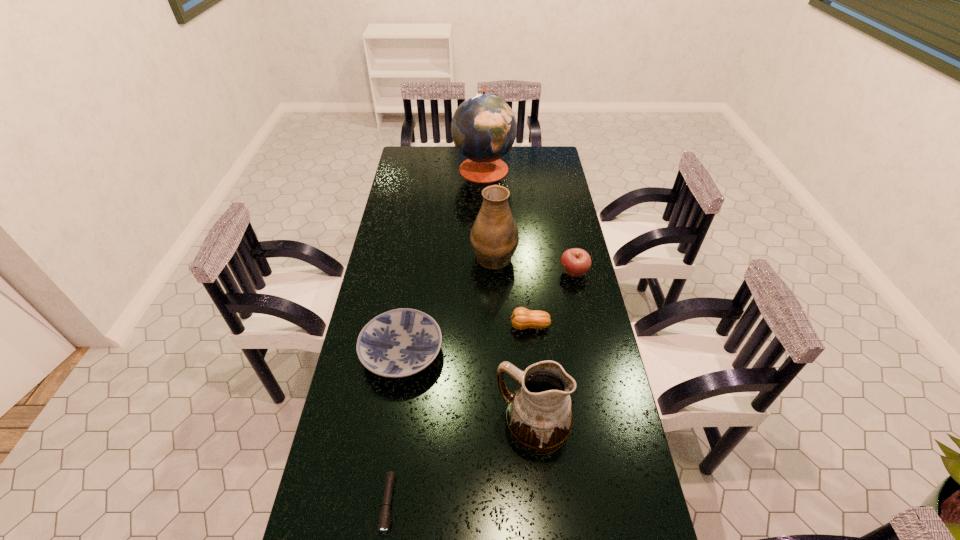
You are a GUI agent. You are given a task and a screenshot of the screen. Output one action in this format:
    pyautogui.click(x=<x>, y=<y>)
    Task: Click on the globe
    Image resolution: width=960 pixels, height=540 pixels.
    Given the screenshot: What is the action you would take?
    pyautogui.click(x=483, y=127)

You are a GUI agent. You are given a task and a screenshot of the screen. Output one action in this format:
    pyautogui.click(x=<x>, y=<y>)
    Task: Click on the tallest object
    
    Given the screenshot: What is the action you would take?
    [x=483, y=127]

You are a GUI agent. You are given a task and a screenshot of the screen. Output one action in this format:
    pyautogui.click(x=<x>, y=<y>)
    Task: Click on the farther pitcher
    The width and height of the screenshot is (960, 540).
    Given the screenshot: What is the action you would take?
    pyautogui.click(x=494, y=238)

This screenshot has height=540, width=960. Find the location of `the second nearest object`. the second nearest object is located at coordinates (539, 415).

The width and height of the screenshot is (960, 540). Find the location of `the rightmost object`. the rightmost object is located at coordinates (576, 262).

Identify the location of the fourth shortest object. This screenshot has height=540, width=960. (576, 262).

Image resolution: width=960 pixels, height=540 pixels. I want to click on gourd, so click(522, 318).

This screenshot has width=960, height=540. Identify the location of plate. (398, 343).

I want to click on the nearest object, so click(384, 520).

This screenshot has height=540, width=960. I want to click on flashlight, so tap(384, 520).